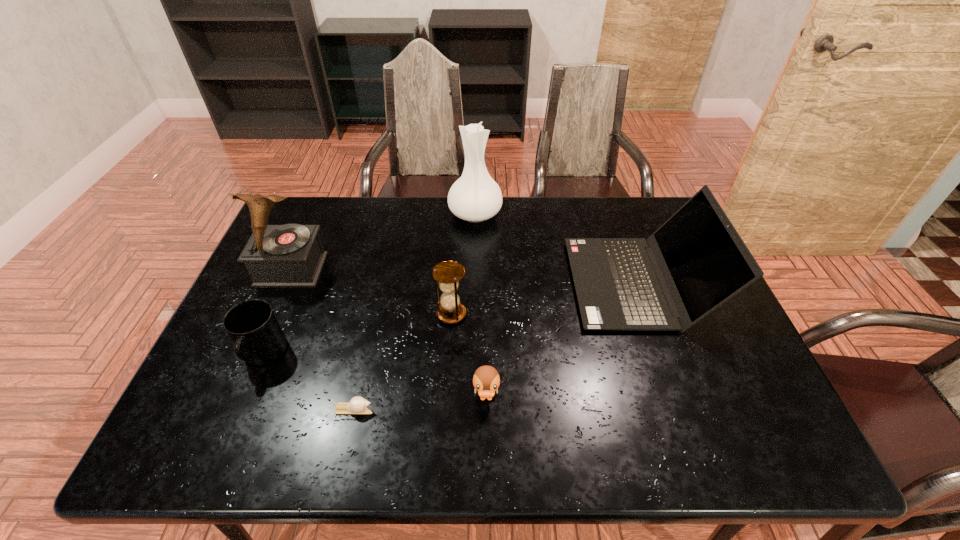
Find the location of a particular element. The height and width of the screenshot is (540, 960). free space located 0.140m at the horn opening of the phonograph_record is located at coordinates (267, 327).

This screenshot has width=960, height=540. In order to click on vacant space located on the screen of the laptop computer in this screenshot , I will do `click(454, 283)`.

The height and width of the screenshot is (540, 960). In order to click on free spot located on the screen of the laptop computer in this screenshot , I will do `click(465, 283)`.

Where is `free region located 0.350m on the screen of the laptop computer`? free region located 0.350m on the screen of the laptop computer is located at coordinates (451, 283).

Locate an element on the screen. The width and height of the screenshot is (960, 540). vacant space situated on the right of the fourth tallest object is located at coordinates pyautogui.click(x=604, y=314).

The height and width of the screenshot is (540, 960). What are the coordinates of `free region located 0.110m on the side of the mug with the handle` in the screenshot? It's located at (235, 422).

In order to click on free space located on the shell of the shortest object in this screenshot , I will do `click(542, 409)`.

This screenshot has height=540, width=960. What are the coordinates of `object at the far edge` in the screenshot? It's located at (475, 196).

Find the location of a particular element. This screenshot has height=540, width=960. phonograph_record that is at the left edge is located at coordinates (291, 255).

Find the location of a particular element. This screenshot has width=960, height=540. mug that is at the left edge is located at coordinates (259, 339).